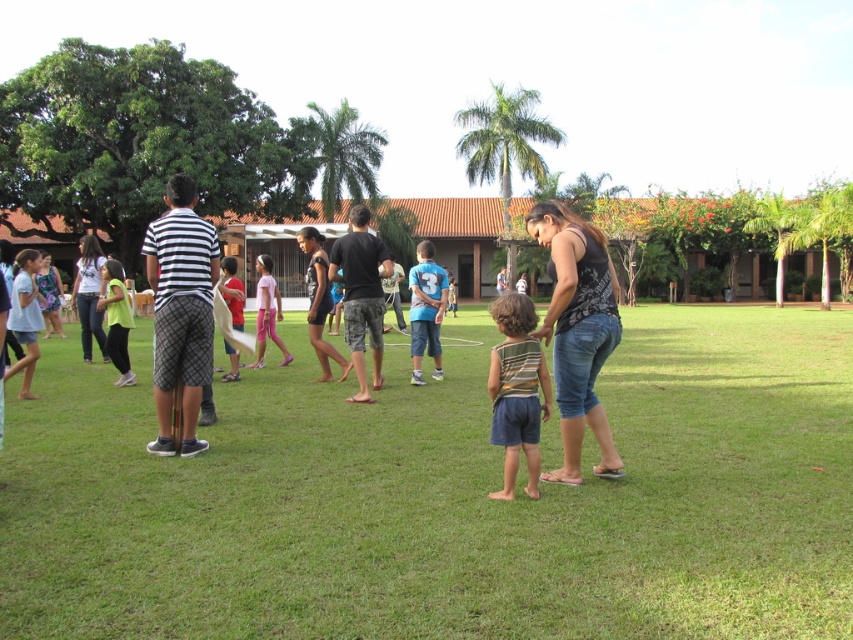
Who is more forward, (199,323) or (502,326)?

Point (502,326) is more forward.

Image resolution: width=853 pixels, height=640 pixels. Describe the element at coordinates (180, 310) in the screenshot. I see `striped cotton shirt at center` at that location.

The height and width of the screenshot is (640, 853). What are the coordinates of `striped cotton shirt at center` in the screenshot? It's located at (180, 310).

Does point (556, 230) come behind point (112, 284)?

No, it is not.

Does point (550, 214) lie behind point (109, 358)?

No.

Identify the location of black printed tank top at center. The image size is (853, 640). (577, 332).

Consider the image. Is camouflage shorts at center shorter than blue cotton shirt at center?

Incorrect, camouflage shorts at center's height does not fall short of blue cotton shirt at center's.

Who is positioned more to the right, camouflage shorts at center or blue cotton shirt at center?

blue cotton shirt at center is more to the right.

Is point (343, 316) farther from viewer compared to point (428, 337)?

No, (343, 316) is in front of (428, 337).

Locate an element on the screen. This screenshot has height=640, width=853. camouflage shorts at center is located at coordinates (361, 294).